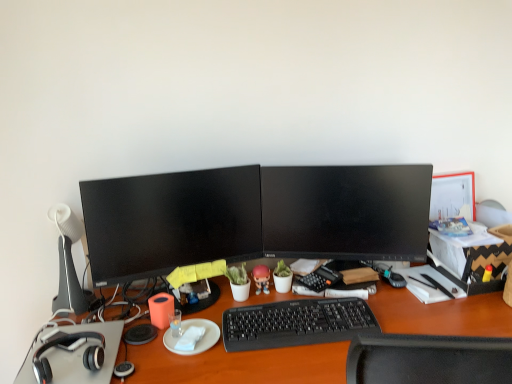
This screenshot has width=512, height=384. In order to click on space that is in front of black plastic keyboard at center in this screenshot , I will do `click(294, 363)`.